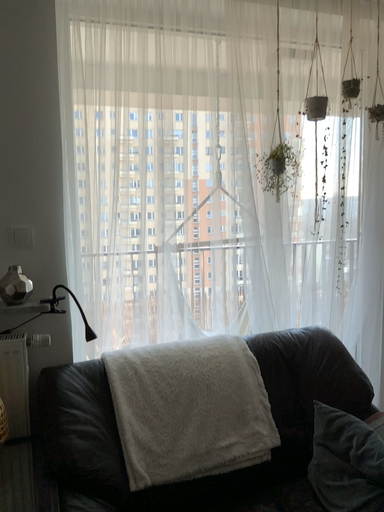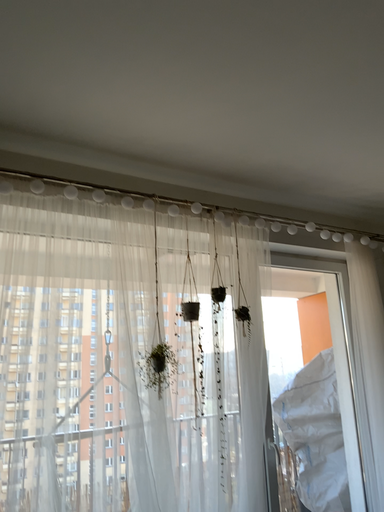
Question: How did the camera likely rotate when shooting the video?

Choices:
 (A) rotated downward
 (B) rotated upward

Answer: (B)